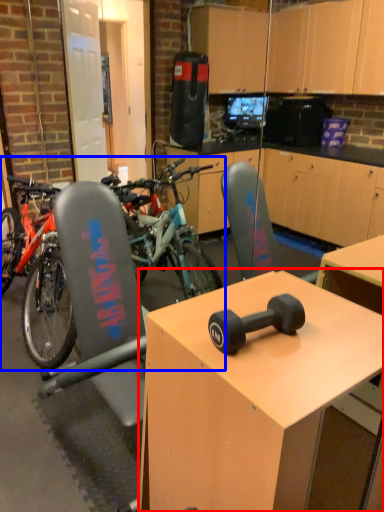
Question: Which object appears farthest to the camera in this image, desk (highlighted by a red box) or mountain bike (highlighted by a blue box)?

Choices:
 (A) desk
 (B) mountain bike

Answer: (B)